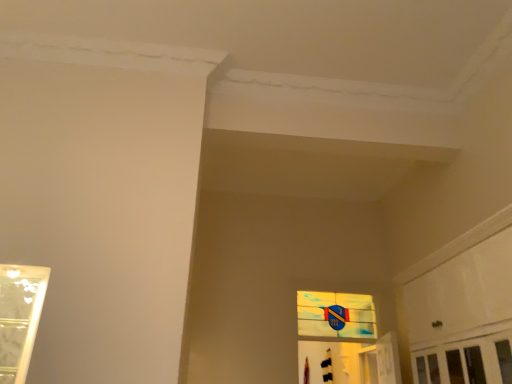
Question: Should I look upward or downward to see translucent glass mosaic at center?

Choices:
 (A) down
 (B) up

Answer: (A)